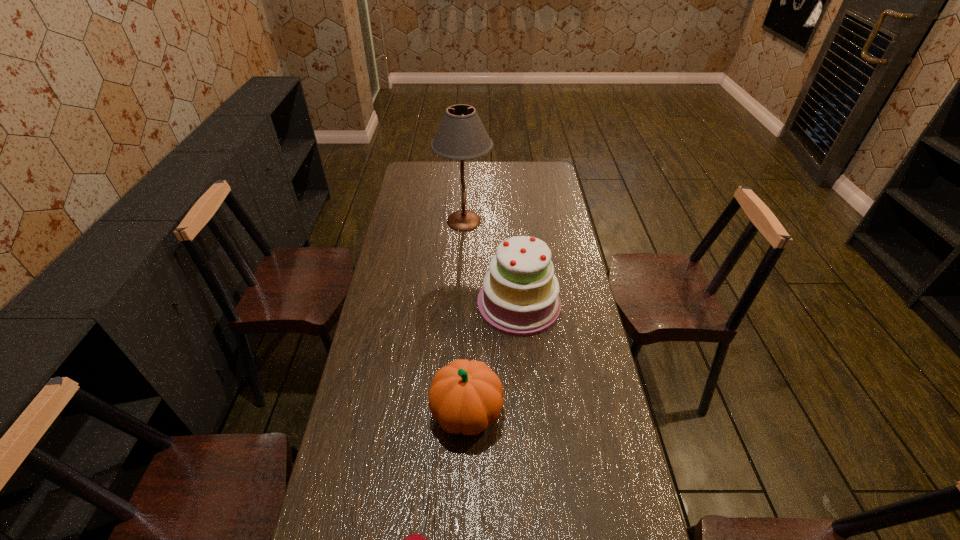
You are a GUI agent. You are given a task and a screenshot of the screen. Output one action in this format:
    pyautogui.click(x=<x>, y=<y>)
    Task: Click on the farthest object
    The width and height of the screenshot is (960, 540).
    Given the screenshot: What is the action you would take?
    pyautogui.click(x=461, y=135)

The width and height of the screenshot is (960, 540). I want to click on the tallest object, so click(x=461, y=135).

Locate an element on the screen. This screenshot has width=960, height=540. cake is located at coordinates (519, 297).

I want to click on the second tallest object, so click(x=519, y=297).

Identify the location of the third farthest object. Image resolution: width=960 pixels, height=540 pixels. (466, 396).

Identify the location of the second shortest object. (466, 396).

Where is `vacant space located 0.180m on the front-facing side of the table lamp`? Image resolution: width=960 pixels, height=540 pixels. vacant space located 0.180m on the front-facing side of the table lamp is located at coordinates (532, 221).

The height and width of the screenshot is (540, 960). Identify the location of vacant point located on the back of the cake. (512, 228).

Image resolution: width=960 pixels, height=540 pixels. Identify the location of vacant space situated on the back of the third tallest object. (468, 332).

Find the location of a particular element. The image size is (960, 540). object that is at the right edge is located at coordinates (519, 297).